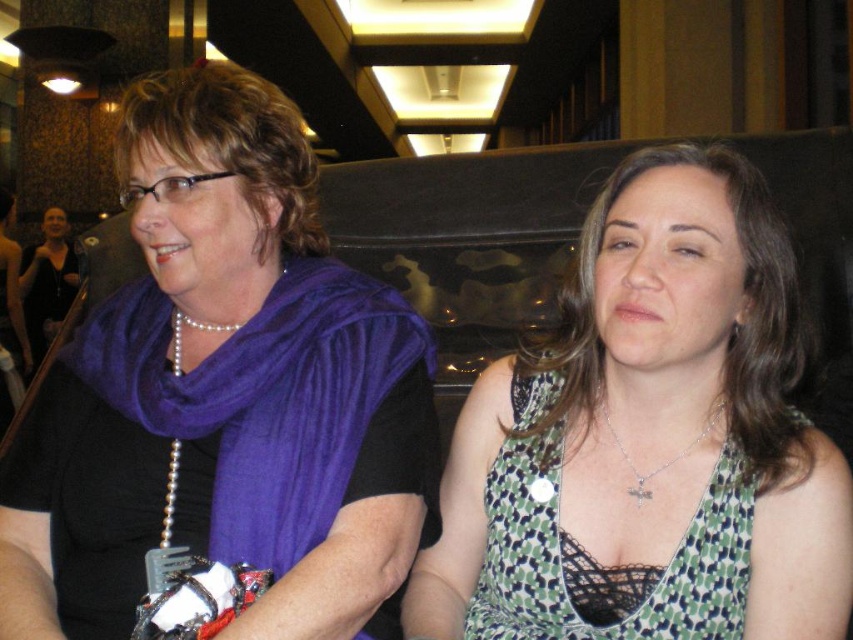
Between point (44, 320) and point (637, 480), which one is positioned behind?

Point (44, 320)

At what (x,y) coordinates should I click in order to perform the action: click on black fabric dress at left. Please return your answer as a coordinate pair (x, y). This screenshot has width=853, height=640. Looking at the image, I should click on (47, 280).

Between green printed fabric dress at center and black fabric dress at left, which one has more height?

black fabric dress at left is taller.

Looking at this image, is green printed fabric dress at center smaller than black fabric dress at left?

Yes.

Which is in front, point (741, 497) or point (55, 291)?

Point (741, 497) is more forward.

Locate an element on the screen. green printed fabric dress at center is located at coordinates (648, 440).

Between purple scarf at left and green dotted fabric dress at center, which one has more height?

With more height is purple scarf at left.

Does purple scarf at left have a larger size compared to green dotted fabric dress at center?

Correct, purple scarf at left is larger in size than green dotted fabric dress at center.

Is point (189, 374) positioned in front of point (704, 573)?

No, it is behind (704, 573).

This screenshot has height=640, width=853. Find the location of `purple scarf at left`. purple scarf at left is located at coordinates coord(225,394).